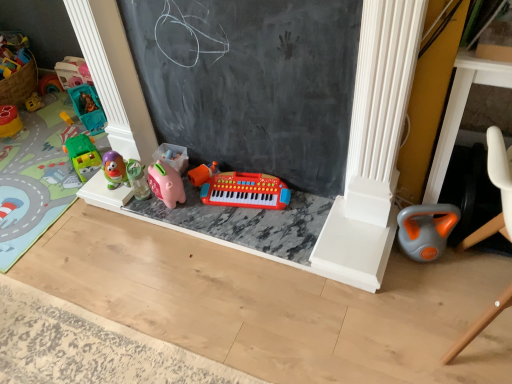
Question: Is gray-orange plastic kettlebell at lower right, which ranks as the first toy in right-to-left order, directly adjacent to orange plastic toy car at lower right?

Choices:
 (A) yes
 (B) no

Answer: (B)

Question: Is gray-orange plastic kettlebell at lower right, acting as the 7th toy starting from the left, in front of orange plastic toy car at lower right?

Choices:
 (A) no
 (B) yes

Answer: (A)

Question: Is gray-orange plastic kettlebell at lower right, acting as the 7th toy starting from the left, outside orange plastic toy car at lower right?

Choices:
 (A) no
 (B) yes

Answer: (B)

Question: From the image's perspective, is gray-orange plastic kettlebell at lower right, which ranks as the first toy in right-to-left order, on top of orange plastic toy car at lower right?

Choices:
 (A) no
 (B) yes

Answer: (A)

Question: Is gray-orange plastic kettlebell at lower right, acting as the 7th toy starting from the left, facing towards orange plastic toy car at lower right?

Choices:
 (A) yes
 (B) no

Answer: (B)

Question: Considering the relative sizes of gray-orange plastic kettlebell at lower right, acting as the 7th toy starting from the left, and orange plastic toy car at lower right in the image provided, is gray-orange plastic kettlebell at lower right, acting as the 7th toy starting from the left, smaller than orange plastic toy car at lower right?

Choices:
 (A) yes
 (B) no

Answer: (A)

Question: Can you confirm if pink rubber piggy bank at center, which ranks as the fourth toy in left-to-right order, is positioned to the left of black chalkboard at center?

Choices:
 (A) no
 (B) yes

Answer: (B)

Question: Is pink rubber piggy bank at center, which ranks as the fourth toy in left-to-right order, looking in the opposite direction of black chalkboard at center?

Choices:
 (A) no
 (B) yes

Answer: (B)

Question: Does pink rubber piggy bank at center, arranged as the 4th toy when viewed from the right, touch black chalkboard at center?

Choices:
 (A) no
 (B) yes

Answer: (A)

Question: Could you tell me if pink rubber piggy bank at center, which ranks as the fourth toy in left-to-right order, is turned towards black chalkboard at center?

Choices:
 (A) yes
 (B) no

Answer: (B)

Question: Considering the relative sizes of pink rubber piggy bank at center, which ranks as the fourth toy in left-to-right order, and black chalkboard at center in the image provided, is pink rubber piggy bank at center, which ranks as the fourth toy in left-to-right order, taller than black chalkboard at center?

Choices:
 (A) no
 (B) yes

Answer: (A)

Question: Does pink rubber piggy bank at center, arranged as the 4th toy when viewed from the right, contain black chalkboard at center?

Choices:
 (A) yes
 (B) no

Answer: (B)

Question: Does rubberized green car at left, which is counted as the 7th toy, starting from the right, come in front of black chalkboard at center?

Choices:
 (A) yes
 (B) no

Answer: (B)